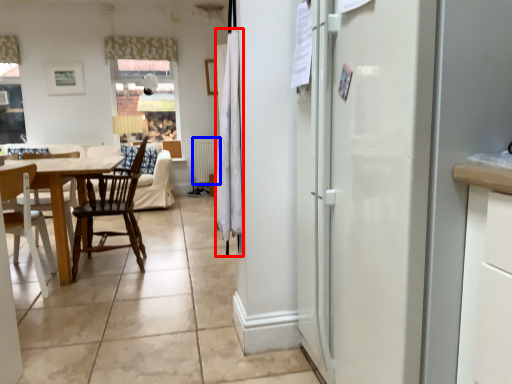
Question: Which point is closer to the camera, curtain (highlighted by a red box) or radiator (highlighted by a blue box)?

Choices:
 (A) curtain
 (B) radiator

Answer: (A)